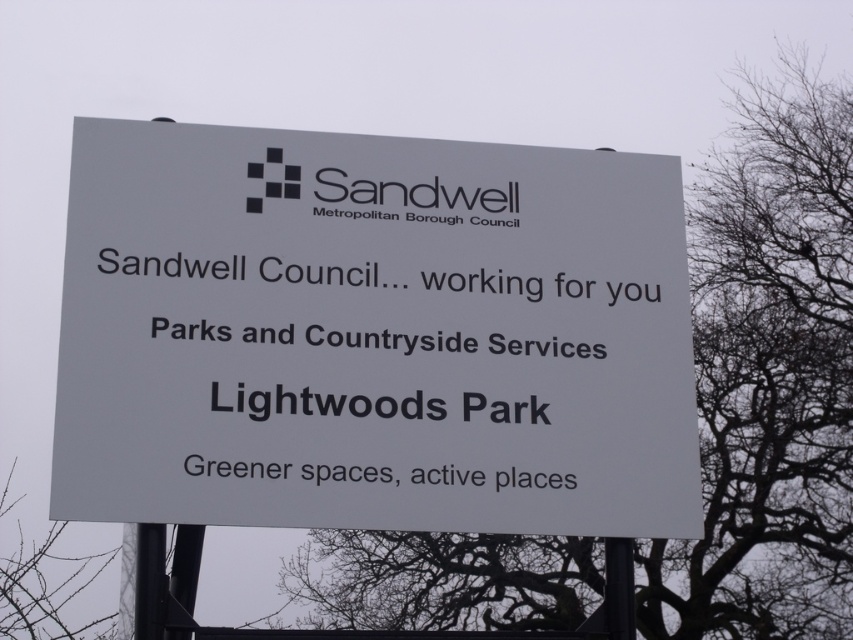
You are standing in front of the signboard at Lightwoods Park. There is a point marked at coordinates (372,333). What is the location of this point relative to the white plastic sign at center?

The point (372,333) is located on the white plastic sign at center.

You are standing in Lightwoods Park and want to take a photo of the white plastic sign at center and the bare branches at upper right together in the same frame. Given that your camera can capture a maximum distance of 20 meters between objects, will you be able to do this?

The white plastic sign at center and bare branches at upper right are 22.20 meters apart from each other, which exceeds the camera maximum distance of 20 meters. Therefore, you won not be able to capture both in the same frame.